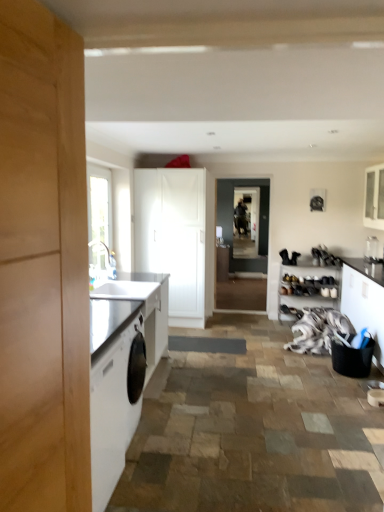
Question: Does dark gray matte screen door at center, the second screen door positioned from the right, have a greater height compared to white glossy cabinet at upper right, the first cabinetry in the right-to-left sequence?

Choices:
 (A) yes
 (B) no

Answer: (A)

Question: From the image's perspective, is dark gray matte screen door at center, the 1th screen door when ordered from left to right, on top of white glossy cabinet at upper right, which is the fourth cabinetry from left to right?

Choices:
 (A) yes
 (B) no

Answer: (B)

Question: Does dark gray matte screen door at center, the second screen door positioned from the right, appear on the left side of white glossy cabinet at upper right, the first cabinetry in the right-to-left sequence?

Choices:
 (A) no
 (B) yes

Answer: (B)

Question: Considering the relative positions of dark gray matte screen door at center, the second screen door positioned from the right, and white glossy cabinet at upper right, the first cabinetry in the right-to-left sequence, in the image provided, is dark gray matte screen door at center, the second screen door positioned from the right, to the right of white glossy cabinet at upper right, the first cabinetry in the right-to-left sequence, from the viewer's perspective?

Choices:
 (A) no
 (B) yes

Answer: (A)

Question: Does dark gray matte screen door at center, the second screen door positioned from the right, contain white glossy cabinet at upper right, the first cabinetry in the right-to-left sequence?

Choices:
 (A) no
 (B) yes

Answer: (A)

Question: From a real-world perspective, is white glossy cabinet at upper right, the first cabinetry in the right-to-left sequence, positioned above or below clear glass vase at upper right?

Choices:
 (A) below
 (B) above

Answer: (B)

Question: Considering the positions of white glossy cabinet at upper right, the first cabinetry in the right-to-left sequence, and clear glass vase at upper right in the image, is white glossy cabinet at upper right, the first cabinetry in the right-to-left sequence, wider or thinner than clear glass vase at upper right?

Choices:
 (A) wide
 (B) thin

Answer: (A)

Question: In the image, is white glossy cabinet at upper right, which is the fourth cabinetry from left to right, on the left side or the right side of clear glass vase at upper right?

Choices:
 (A) left
 (B) right

Answer: (B)

Question: Relative to clear glass vase at upper right, is white glossy cabinet at upper right, which is the fourth cabinetry from left to right, in front or behind?

Choices:
 (A) front
 (B) behind

Answer: (A)

Question: In terms of height, does white glossy cabinet at upper right, the first cabinetry in the right-to-left sequence, look taller or shorter compared to white fabric at lower right?

Choices:
 (A) short
 (B) tall

Answer: (B)

Question: Looking at the image, does white glossy cabinet at upper right, which is the fourth cabinetry from left to right, seem bigger or smaller compared to white fabric at lower right?

Choices:
 (A) big
 (B) small

Answer: (B)

Question: In terms of width, does white glossy cabinet at upper right, which is the fourth cabinetry from left to right, look wider or thinner when compared to white fabric at lower right?

Choices:
 (A) thin
 (B) wide

Answer: (A)

Question: From the image's perspective, is white glossy cabinet at upper right, which is the fourth cabinetry from left to right, above or below white fabric at lower right?

Choices:
 (A) below
 (B) above

Answer: (B)

Question: Does point 196,174 appear closer or farther from the camera than point 352,266?

Choices:
 (A) farther
 (B) closer

Answer: (A)

Question: In the image, is white matte cabinet at center, which is counted as the 1th cabinetry, starting from the left, on the left side or the right side of black fabric basket at right, the third cabinetry viewed from the left?

Choices:
 (A) left
 (B) right

Answer: (A)